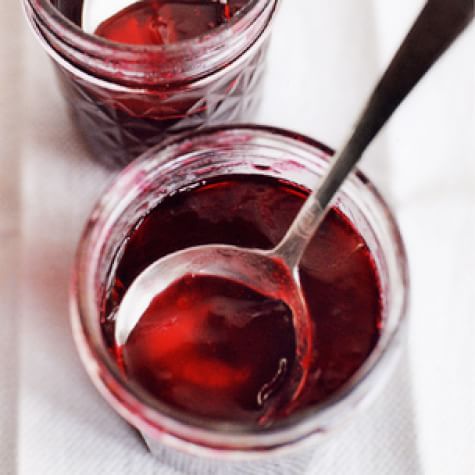
Find the location of `2 glass mason jars`. 2 glass mason jars is located at coordinates (375, 351), (142, 61).